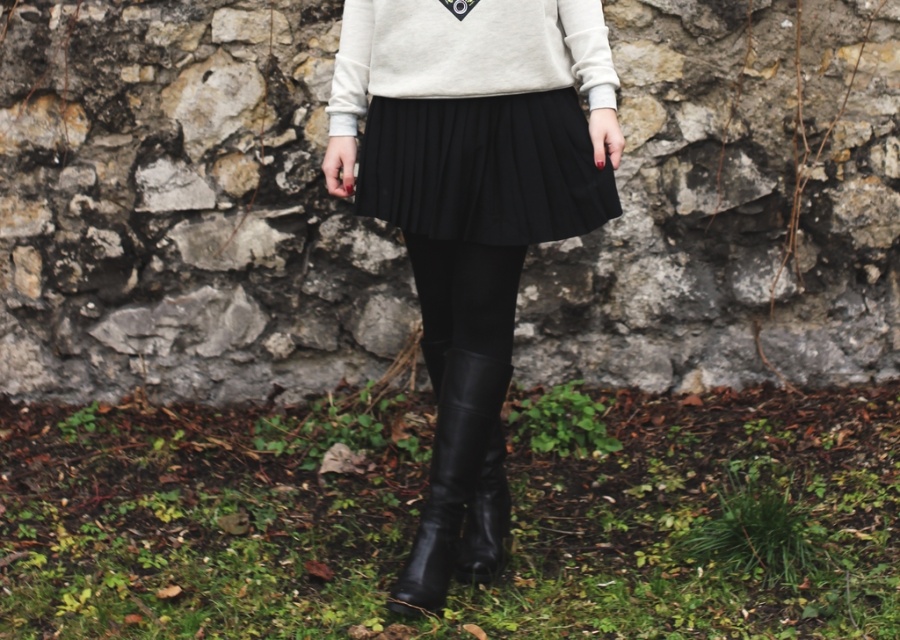
You are a fashion designer observing the outfit of a model in the image. The model is wearing a black leather skirt at center and black leather leggings at center. Which item of clothing appears to be bigger in size?

The black leather skirt at center has a larger size compared to the black leather leggings at center.